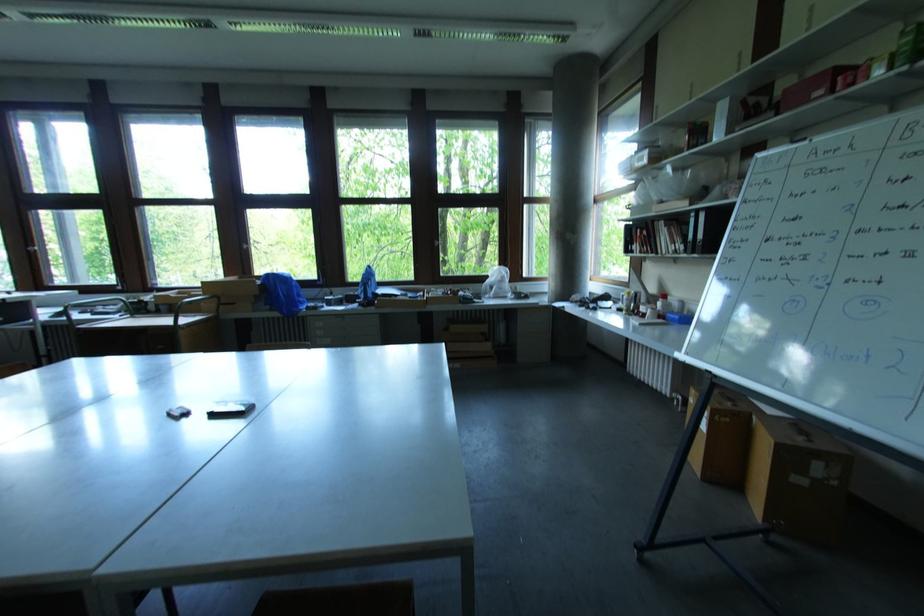
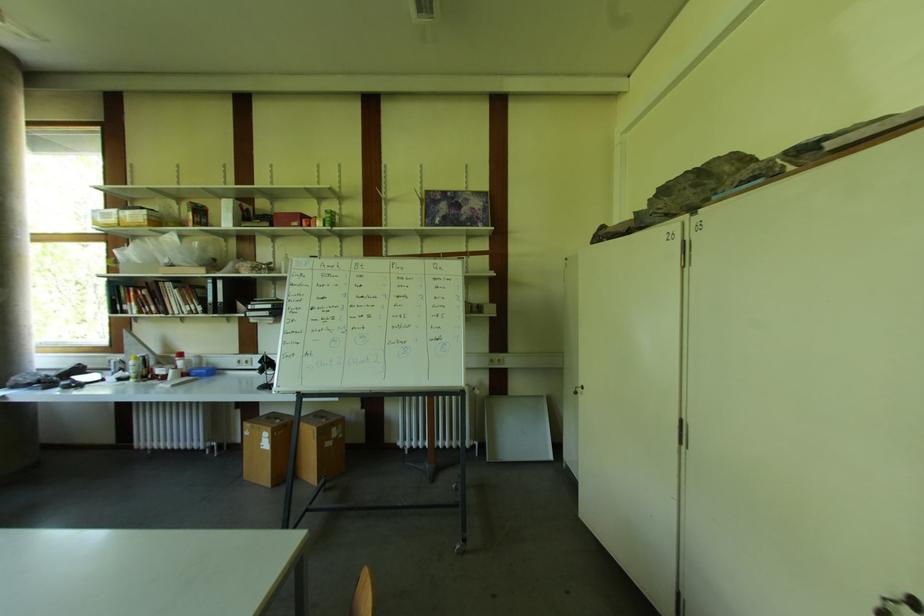
Locate, in the second image, the point that corresponds to the point at 822,94 in the first image.

(298, 225)